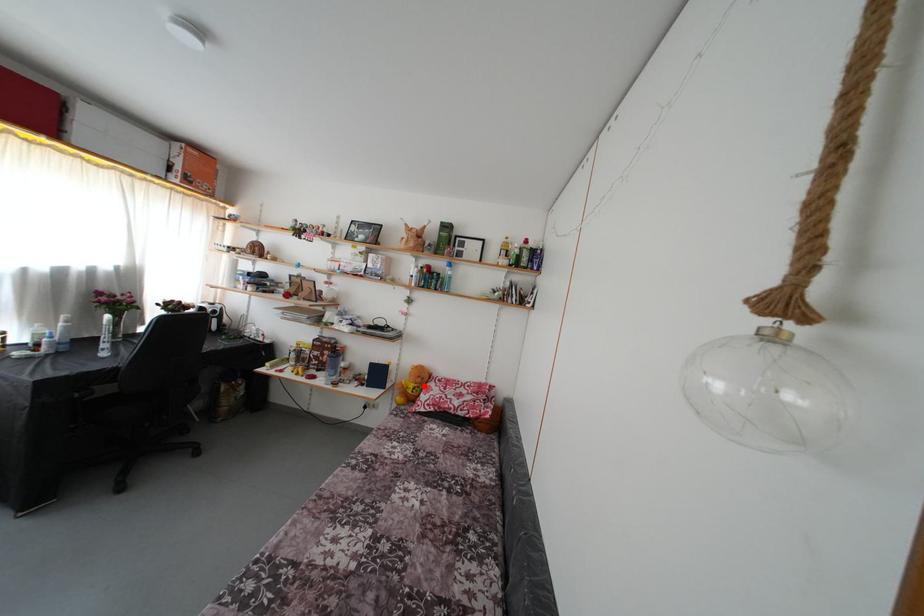
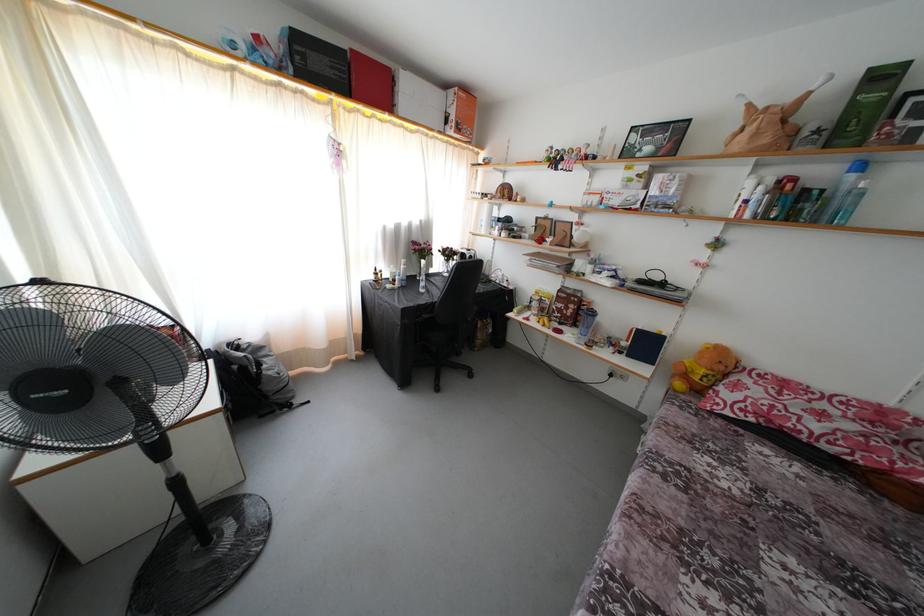
The point at the highlighted location is marked in the first image. Where is the corresponding point in the second image?

(726, 373)